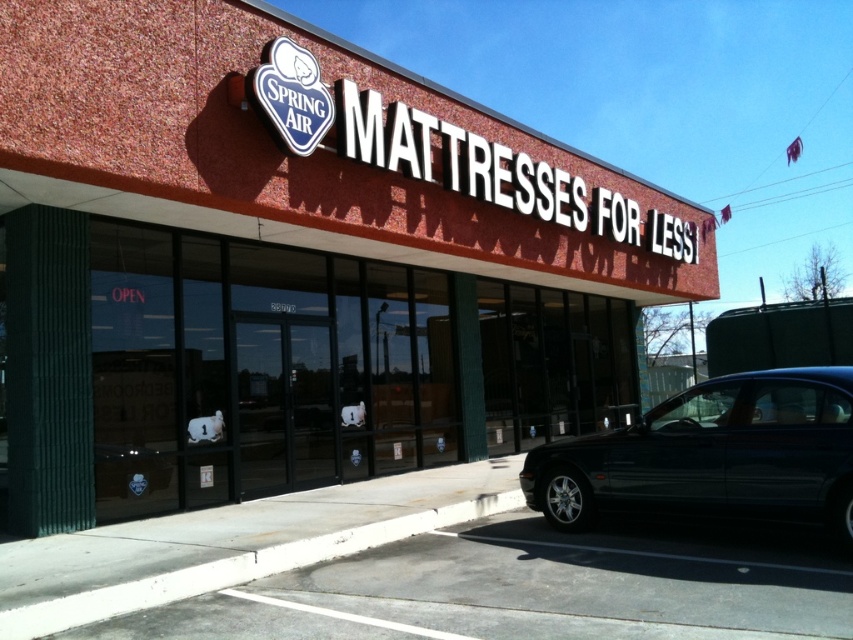
From the picture: How much distance is there between red brick building at center and shiny dark blue sedan at lower right?

red brick building at center is 21.88 feet away from shiny dark blue sedan at lower right.

Image resolution: width=853 pixels, height=640 pixels. Describe the element at coordinates (293, 264) in the screenshot. I see `red brick building at center` at that location.

Who is more forward, (242, 33) or (733, 433)?

Point (733, 433)

I want to click on red brick building at center, so click(293, 264).